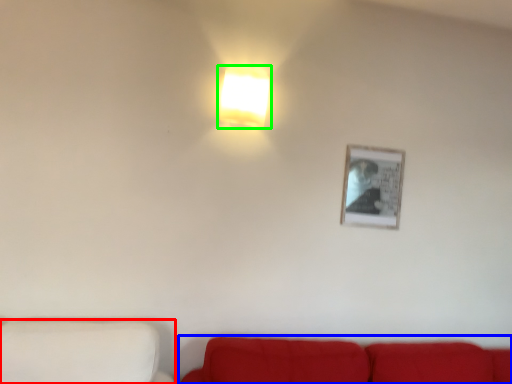
Question: Which is nearer to the furniture (highlighted by a red box)? studio couch (highlighted by a blue box) or lamp (highlighted by a green box).

Choices:
 (A) studio couch
 (B) lamp

Answer: (A)